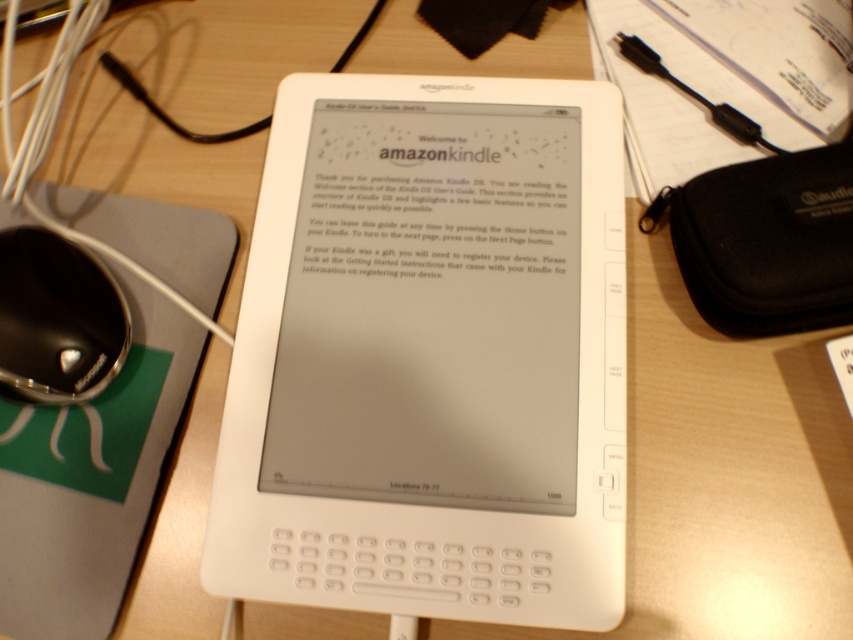
Based on the photo, who is shorter, white matte e-reader at center or black glossy mouse at left?

black glossy mouse at left

Looking at this image, can you confirm if white matte e-reader at center is smaller than black glossy mouse at left?

No.

Find the location of a particular element. This screenshot has height=640, width=853. white matte e-reader at center is located at coordinates (430, 356).